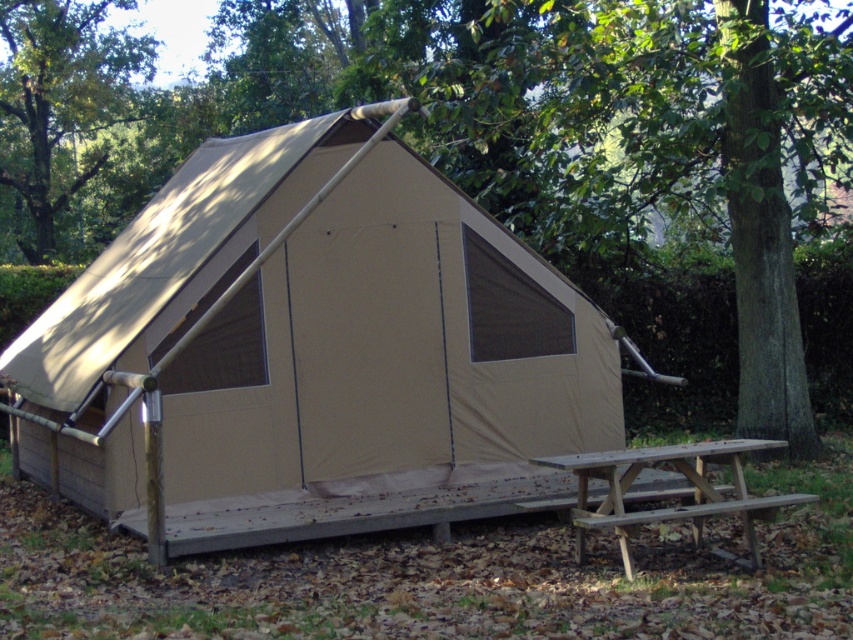
Question: Is the position of wooden picnic table at lower right less distant than that of wooden picnic table at lower center?

Choices:
 (A) yes
 (B) no

Answer: (A)

Question: Among these points, which one is farthest from the camera?

Choices:
 (A) (97, 275)
 (B) (776, 497)
 (C) (750, 536)
 (D) (28, 128)

Answer: (D)

Question: Is brown wooden bench at lower right smaller than wooden picnic table at lower center?

Choices:
 (A) no
 (B) yes

Answer: (A)

Question: Which point is farther from the camera taking this photo?

Choices:
 (A) (107, 106)
 (B) (566, 508)
 (C) (583, 554)
 (D) (309, 403)

Answer: (A)

Question: Which point is farther to the camera?

Choices:
 (A) brown wooden bench at lower right
 (B) tan canvas tent at center
 (C) wooden picnic table at lower right
 (D) wooden picnic table at lower center

Answer: (D)

Question: Does green leafy tree at upper left appear on the left side of brown wooden bench at lower right?

Choices:
 (A) no
 (B) yes

Answer: (B)